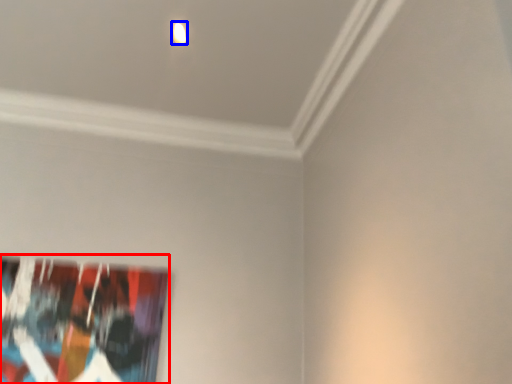
Question: Which point is closer to the camera, picture frame (highlighted by a red box) or light (highlighted by a blue box)?

Choices:
 (A) picture frame
 (B) light

Answer: (B)